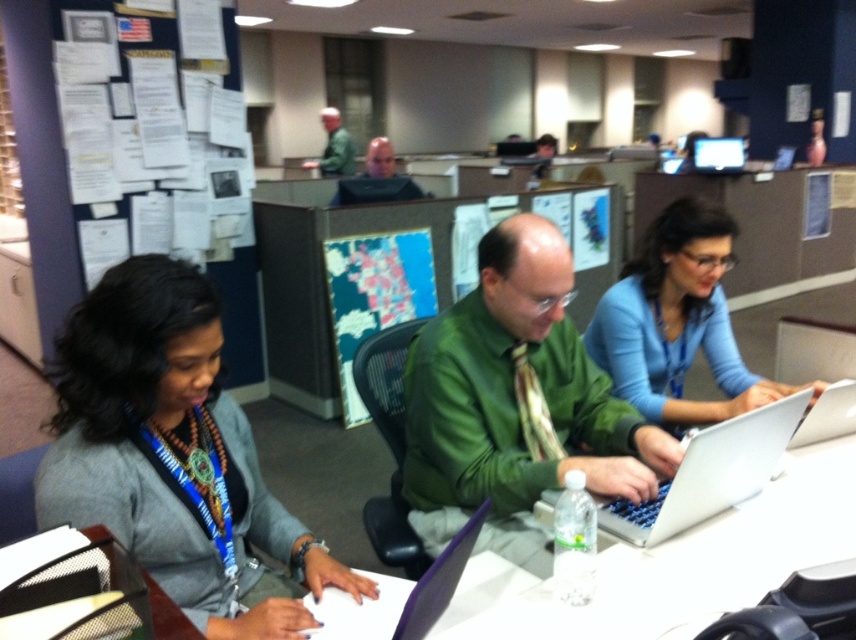
In the office scene, you need to pass by both the gray fabric jacket at lower left and the green matte shirt at center. Which one should you avoid bumping into first while moving from the entrance to your desk?

You should avoid bumping into the gray fabric jacket at lower left first because it is positioned to the left of the green matte shirt at center, meaning it is closer to your path when moving from the entrance to your desk.

You are organizing a photo shoot in this office scene and need to ensure that all items are visible in the frame. Given that the green textured tie at center and the silver metallic monitor at upper center are both in the shot, which object would require a closer camera focus to capture its details?

The green textured tie at center has a smaller size compared to the silver metallic monitor at upper center, so the camera would need to focus closer on the green textured tie at center to capture its details clearly.